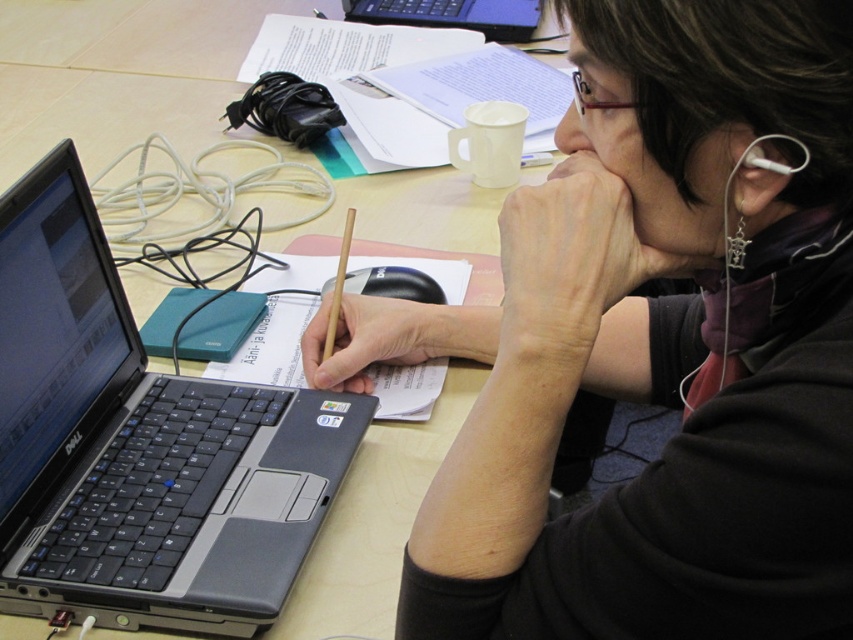
You are a delivery robot with a package that needs to be placed on the table. The package is 40 centimeters long. You see the silver metallic laptop at left and dry skin at center on the table. Can you fit the package between them without moving any other items?

The distance between the silver metallic laptop at left and dry skin at center is 35.67 centimeters. Since the package is 40 centimeters long, it cannot fit in the space between them without moving other items.

You are a virtual assistant trying to organize the items on the desk. You need to determine which of the two points, point (144, 424) or point (527, 339), is closer to you. Which one is closer?

Point (144, 424) is closer to you than point (527, 339) because it is further to the viewer according to the description.

From the picture: You are organizing a desk and need to place the wooden pencil at center and the wooden table at center. According to the image, which object is positioned behind the other?

The wooden pencil at center is behind the wooden table at center according to the image description.